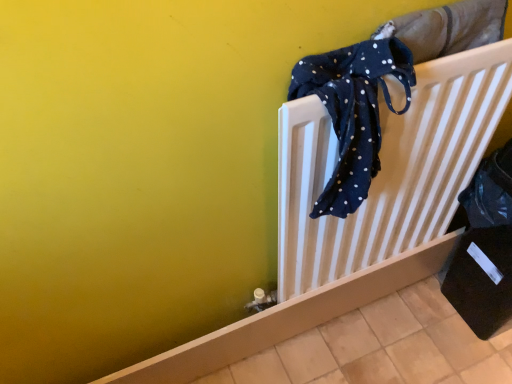
This screenshot has height=384, width=512. In order to click on white matte radiator at upper right in this screenshot , I will do `click(387, 169)`.

Describe the element at coordinates (387, 169) in the screenshot. The image size is (512, 384). I see `white matte radiator at upper right` at that location.

At what (x,y) coordinates should I click in order to perform the action: click on white matte radiator at upper right. Please return your answer as a coordinate pair (x, y). This screenshot has height=384, width=512. Looking at the image, I should click on (387, 169).